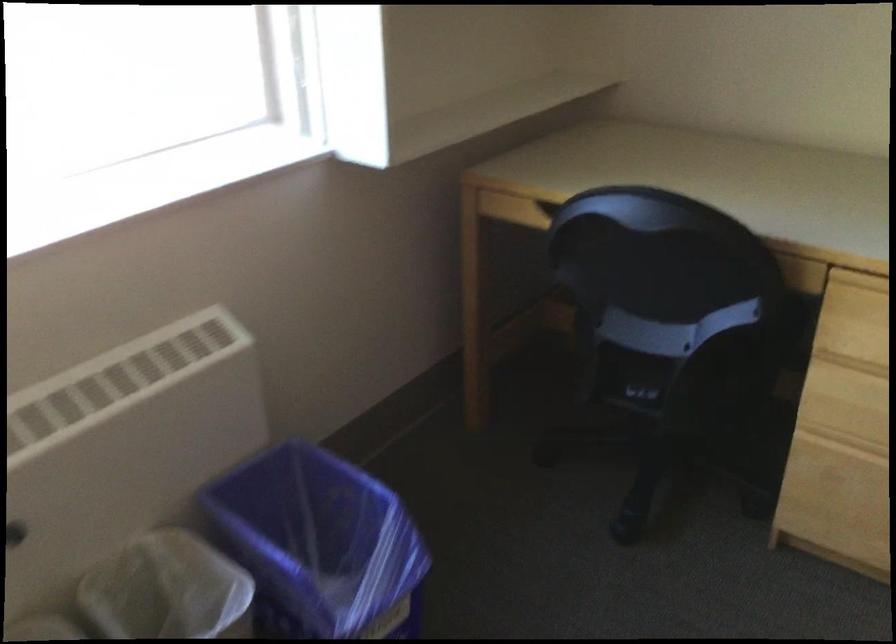
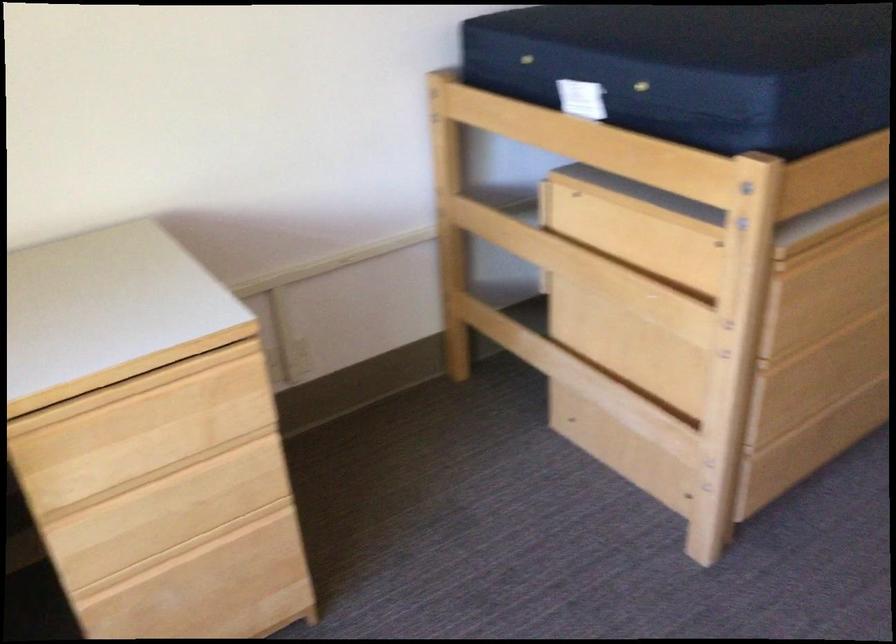
Question: The camera is either moving clockwise (left) or counter-clockwise (right) around the object. The first image is from the beginning of the video and the second image is from the end. Is the camera moving left or right when shooting the video?

Choices:
 (A) Left
 (B) Right

Answer: (A)